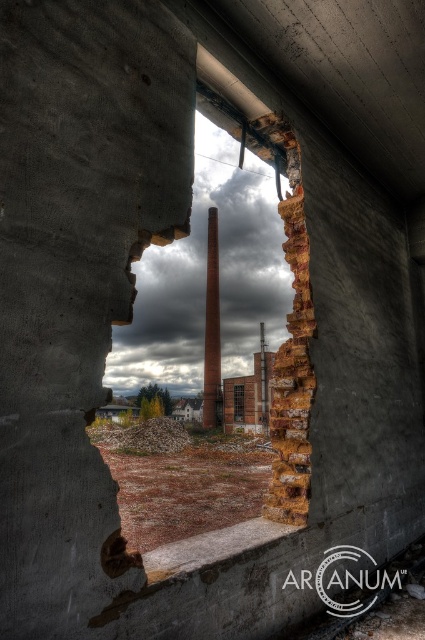
Is point (286, 490) farther from camera compared to point (243, 420)?

That is False.

Who is positioned more to the left, rusty metal hole at center or transparent glass window at center?

transparent glass window at center

Describe the element at coordinates (289, 336) in the screenshot. The height and width of the screenshot is (640, 425). I see `rusty metal hole at center` at that location.

Locate an element on the screen. rusty metal hole at center is located at coordinates (x=289, y=336).

Does point (207, 216) come in front of point (243, 401)?

No.

Does smooth concrete pillar at center come behind transparent glass window at center?

Yes.

The height and width of the screenshot is (640, 425). Find the location of `smooth concrete pillar at center`. smooth concrete pillar at center is located at coordinates (212, 330).

At what (x,y) coordinates should I click in order to perform the action: click on smooth concrete pillar at center. Please return your answer as a coordinate pair (x, y). Image resolution: width=425 pixels, height=640 pixels. Looking at the image, I should click on (x=212, y=330).

Can you confirm if rusty metal hole at center is bigger than smooth concrete pillar at center?

Yes.

Which is behind, point (292, 346) or point (215, 227)?

The point (215, 227) is more distant.

You are a GUI agent. You are given a task and a screenshot of the screen. Output one action in this format:
    pyautogui.click(x=<x>, y=<y>)
    Task: Click on the rusty metal hole at center
    The image size is (425, 640).
    Given the screenshot: What is the action you would take?
    pyautogui.click(x=289, y=336)

At what (x,y) coordinates should I click in order to perform the action: click on rusty metal hole at center. Please return your answer as a coordinate pair (x, y). Looking at the image, I should click on (289, 336).